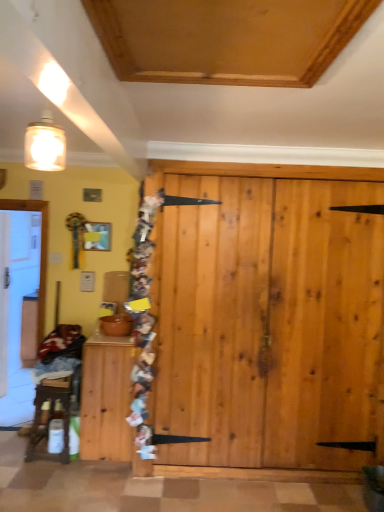
Question: Should I look upward or downward to see wooden cabinet at lower left?

Choices:
 (A) up
 (B) down

Answer: (B)

Question: From a real-world perspective, is wooden table at left on top of wooden cabinet at lower left?

Choices:
 (A) yes
 (B) no

Answer: (B)

Question: Is wooden table at left outside wooden cabinet at lower left?

Choices:
 (A) yes
 (B) no

Answer: (A)

Question: From the image's perspective, is wooden table at left on wooden cabinet at lower left?

Choices:
 (A) no
 (B) yes

Answer: (A)

Question: Considering the relative sizes of wooden table at left and wooden cabinet at lower left in the image provided, is wooden table at left smaller than wooden cabinet at lower left?

Choices:
 (A) yes
 (B) no

Answer: (A)

Question: Is wooden table at left to the right of wooden cabinet at lower left from the viewer's perspective?

Choices:
 (A) yes
 (B) no

Answer: (B)

Question: Is wooden table at left to the left of wooden cabinet at lower left from the viewer's perspective?

Choices:
 (A) yes
 (B) no

Answer: (A)

Question: Is wooden cabinet at lower left wider than wooden table at left?

Choices:
 (A) no
 (B) yes

Answer: (B)

Question: From the image's perspective, would you say wooden cabinet at lower left is positioned over wooden table at left?

Choices:
 (A) yes
 (B) no

Answer: (A)

Question: Does wooden cabinet at lower left have a lesser width compared to wooden table at left?

Choices:
 (A) yes
 (B) no

Answer: (B)

Question: Does wooden cabinet at lower left turn towards wooden table at left?

Choices:
 (A) yes
 (B) no

Answer: (B)

Question: From a real-world perspective, is wooden cabinet at lower left physically below wooden table at left?

Choices:
 (A) yes
 (B) no

Answer: (B)

Question: Considering the relative sizes of wooden cabinet at lower left and wooden table at left in the image provided, is wooden cabinet at lower left bigger than wooden table at left?

Choices:
 (A) yes
 (B) no

Answer: (A)

Question: From the image's perspective, is wooden cabinet at lower left positioned above or below wooden table at left?

Choices:
 (A) above
 (B) below

Answer: (A)